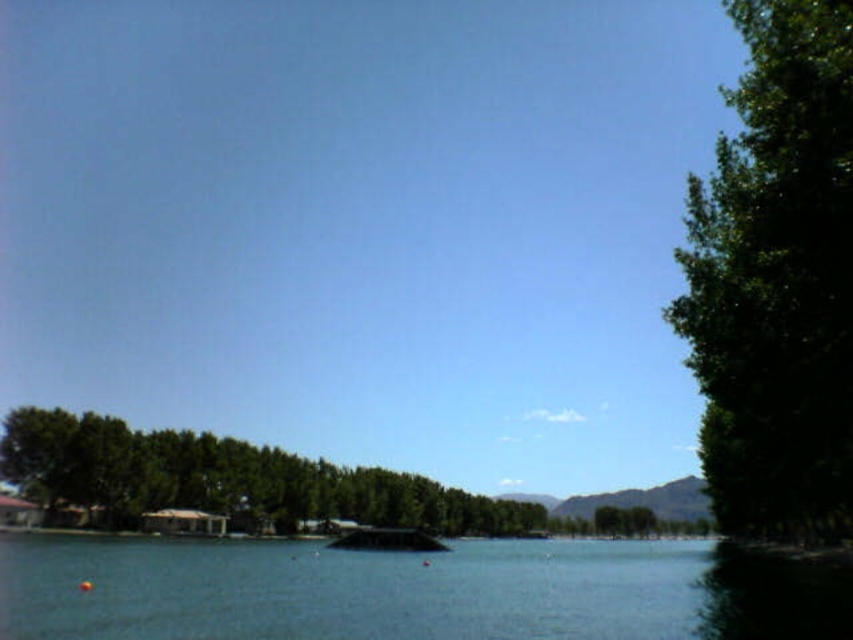
Is green leafy tree at right to the right of clear blue water at center from the viewer's perspective?

Correct, you'll find green leafy tree at right to the right of clear blue water at center.

Based on the photo, can you confirm if green leafy tree at right is bigger than clear blue water at center?

Yes, green leafy tree at right is bigger than clear blue water at center.

Between point (703, 394) and point (585, 636), which one is positioned in front?

Positioned in front is point (585, 636).

The width and height of the screenshot is (853, 640). I want to click on green leafy tree at right, so click(776, 280).

Does clear blue water at center have a larger size compared to green leafy trees at center?

Actually, clear blue water at center might be smaller than green leafy trees at center.

Who is positioned more to the right, clear blue water at center or green leafy trees at center?

clear blue water at center

Between point (30, 609) and point (70, 472), which one is positioned in front?

Point (30, 609)

I want to click on clear blue water at center, so pos(350,589).

Can you confirm if green leafy tree at right is positioned to the right of green leafy trees at center?

Yes, green leafy tree at right is to the right of green leafy trees at center.

Does green leafy tree at right lie in front of green leafy trees at center?

Yes.

Is point (747, 70) closer to camera compared to point (149, 508)?

No.

Locate an element on the screen. The image size is (853, 640). green leafy tree at right is located at coordinates (776, 280).